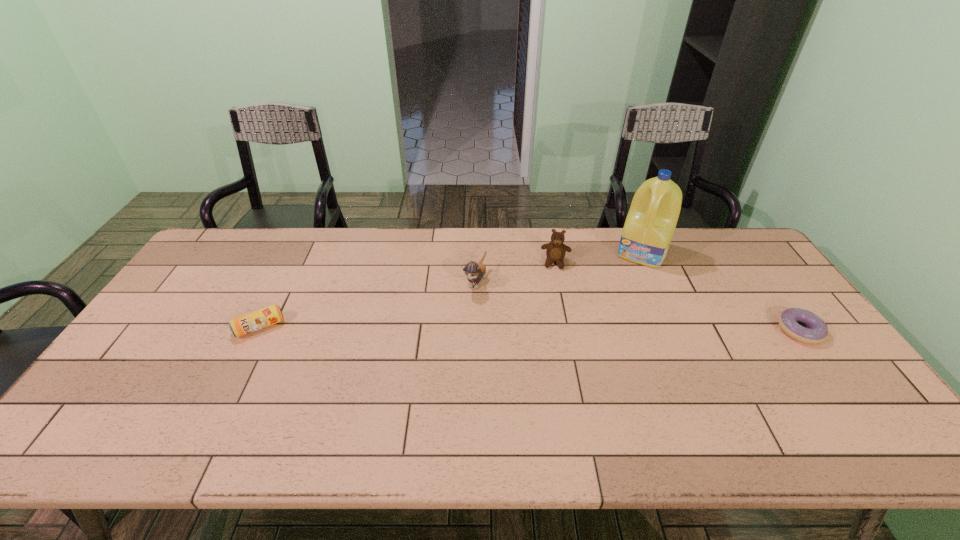
Locate an element on the screen. The width and height of the screenshot is (960, 540). free space between the teddy bear and the leftmost object is located at coordinates (408, 295).

In order to click on free space between the shortest object and the detergent in this screenshot , I will do click(721, 291).

Find the location of `empty space between the teddy bear and the shortest object`. empty space between the teddy bear and the shortest object is located at coordinates (678, 296).

You are a GUI agent. You are given a task and a screenshot of the screen. Output one action in this format:
    pyautogui.click(x=<x>, y=<y>)
    Task: Click on the blank region between the beer can and the third object from right to left
    
    Given the screenshot: What is the action you would take?
    408,295

Where is `empty space that is in between the kitten and the third object from right to left`? The width and height of the screenshot is (960, 540). empty space that is in between the kitten and the third object from right to left is located at coordinates (516, 272).

I want to click on free space between the rightmost object and the leftmost object, so click(x=530, y=329).

Where is `free space between the rightmost object and the kitten`? This screenshot has width=960, height=540. free space between the rightmost object and the kitten is located at coordinates pos(637,306).

The width and height of the screenshot is (960, 540). In order to click on free space between the shortest object and the third object from left to right in this screenshot , I will do `click(678, 296)`.

Locate an element on the screen. This screenshot has height=540, width=960. blank region between the beer can and the teddy bear is located at coordinates (408, 295).

The height and width of the screenshot is (540, 960). I want to click on object that is the closest to the teddy bear, so click(651, 221).